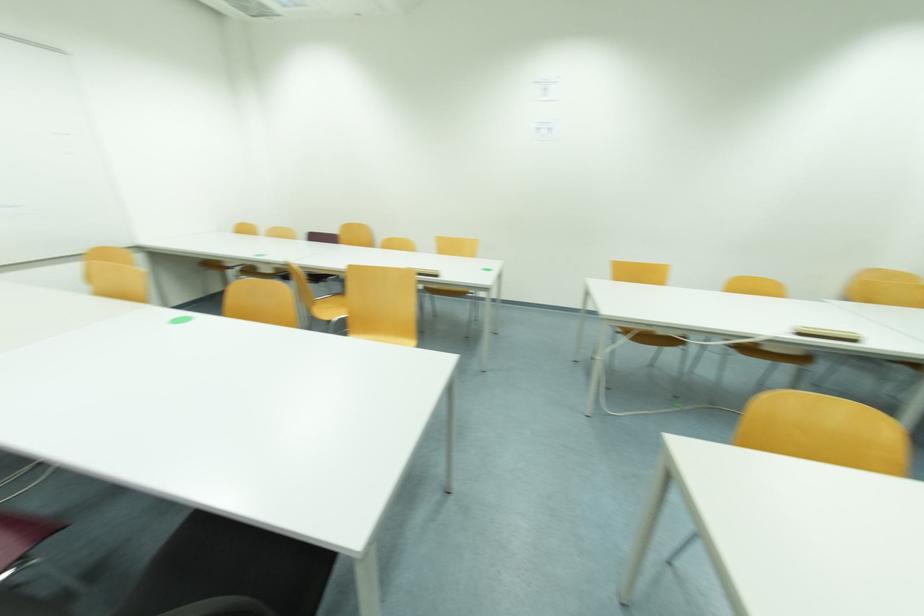
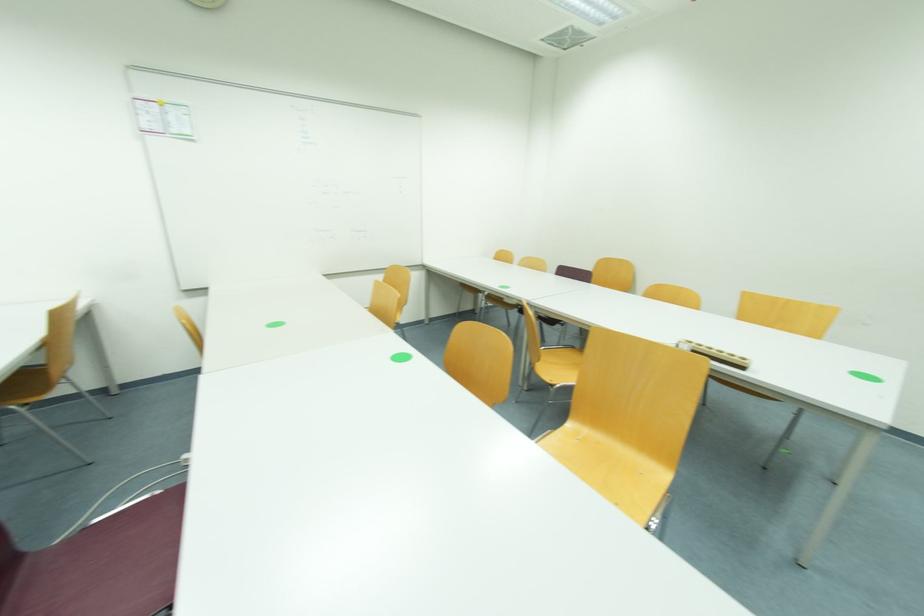
Question: Based on the continuous images, in which direction is the camera rotating? Reply with the corresponding letter.

Choices:
 (A) Left
 (B) Right
 (C) Up
 (D) Down

Answer: (A)